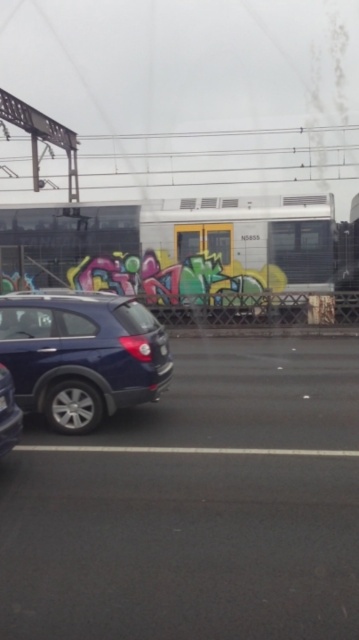
Question: Which point is closer to the camera?

Choices:
 (A) (11, 388)
 (B) (20, 397)

Answer: (A)

Question: Does satin blue suv at left have a smaller size compared to black plastic license plate at lower left?

Choices:
 (A) no
 (B) yes

Answer: (A)

Question: Does satin black car at left have a smaller size compared to black plastic license plate at lower left?

Choices:
 (A) yes
 (B) no

Answer: (B)

Question: Estimate the real-world distances between objects in this image. Which object is farther from the black plastic license plate at lower left?

Choices:
 (A) satin blue suv at left
 (B) satin black car at left

Answer: (A)

Question: Which point appears farthest from the camera in this image?

Choices:
 (A) tap(5, 400)
 (B) tap(126, 374)

Answer: (B)

Question: Can you confirm if satin black car at left is wider than black plastic license plate at lower left?

Choices:
 (A) yes
 (B) no

Answer: (A)